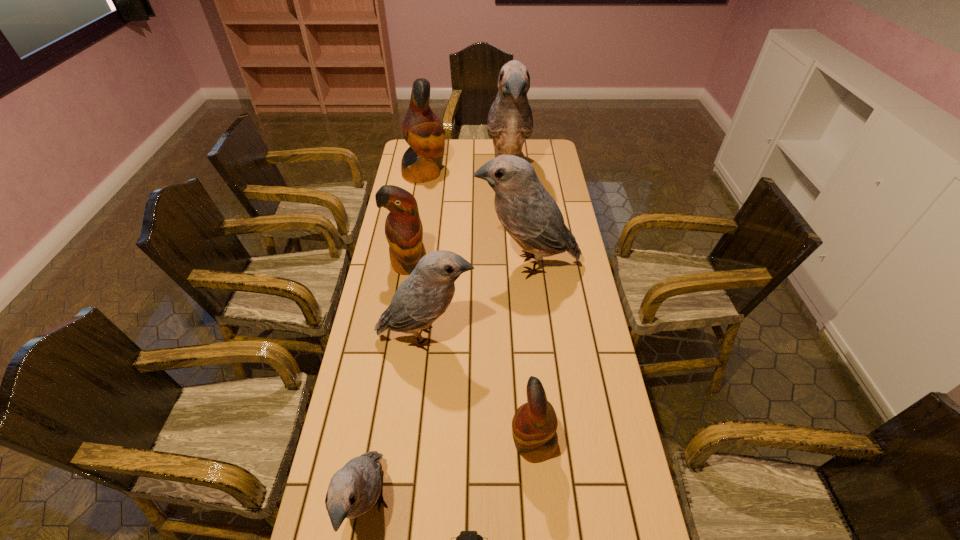
At what (x,y) coordinates should I click in order to perform the action: click on object that is at the far right corner. Please return your answer as a coordinate pair (x, y). Looking at the image, I should click on point(510,122).

Where is `vacant space at the far edge of the desktop`? vacant space at the far edge of the desktop is located at coordinates (475, 140).

You are a GUI agent. You are given a task and a screenshot of the screen. Output one action in this format:
    pyautogui.click(x=<x>, y=<y>)
    Task: Click on the free space at the left edge of the desktop
    The height and width of the screenshot is (540, 960).
    Given the screenshot: What is the action you would take?
    pyautogui.click(x=324, y=489)

This screenshot has width=960, height=540. Identify the location of blank space at the right edge of the desktop. (562, 337).

Where is `free point between the biggest red parrot and the second farthest gray parrot`? The width and height of the screenshot is (960, 540). free point between the biggest red parrot and the second farthest gray parrot is located at coordinates (475, 219).

Identify the location of vacant space in between the second nearest red parrot and the nearest red parrot. This screenshot has width=960, height=540. (471, 354).

The image size is (960, 540). What are the coordinates of `vacant area that lies between the second farthest gray parrot and the rightmost red parrot` in the screenshot? It's located at (530, 354).

Where is `object that is the fourth nearest to the third farthest gray parrot`? object that is the fourth nearest to the third farthest gray parrot is located at coordinates (355, 489).

Identify the location of object that stands as the fourth closest to the smallest gray parrot. Image resolution: width=960 pixels, height=540 pixels. (403, 228).

This screenshot has height=540, width=960. I want to click on parrot that is the sixth closest to the second nearest red parrot, so click(x=355, y=489).